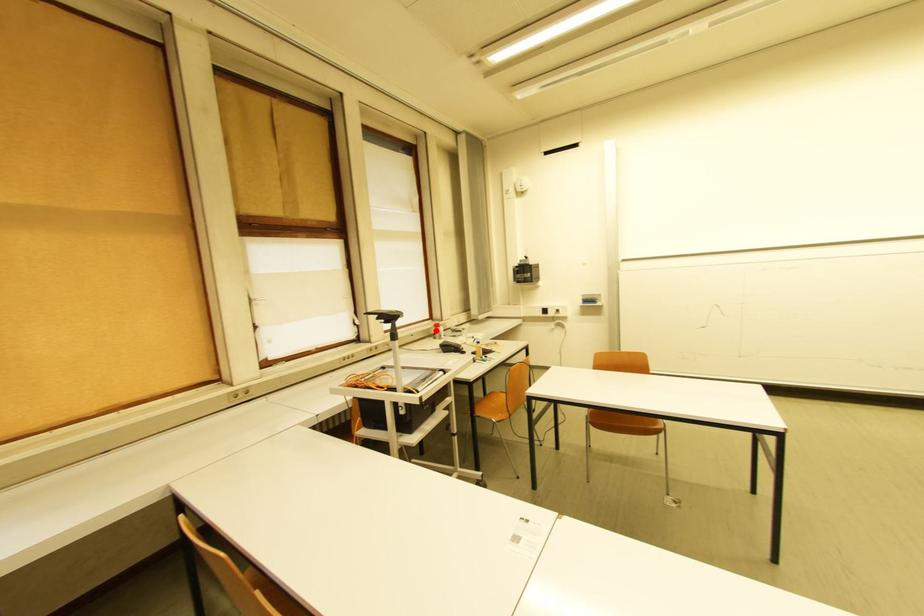
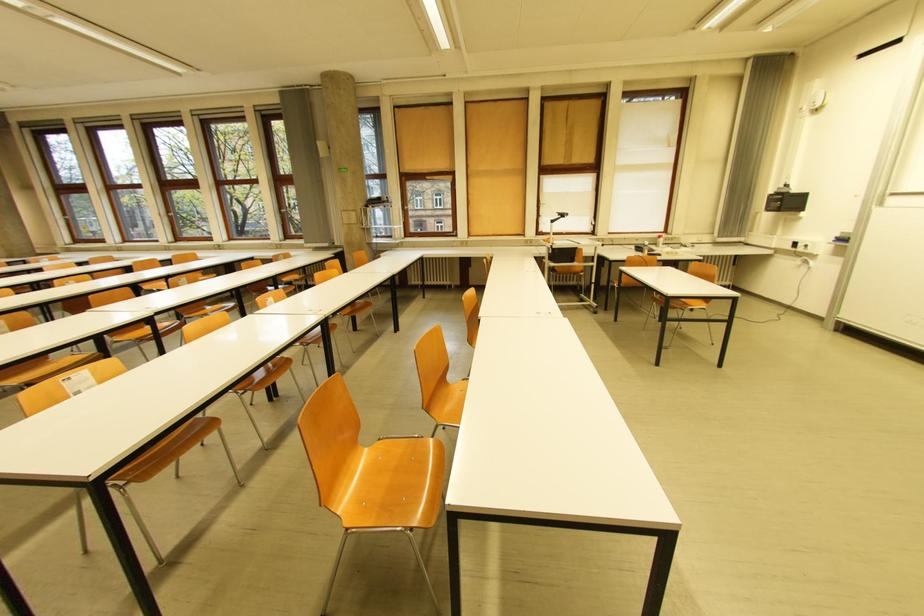
Question: I am providing you with two images of the same scene from different viewpoints. In image1, a red point is highlighted. Considering the same 3D point in image2, which of the following is correct?

Choices:
 (A) It is closer
 (B) It is farther

Answer: (A)